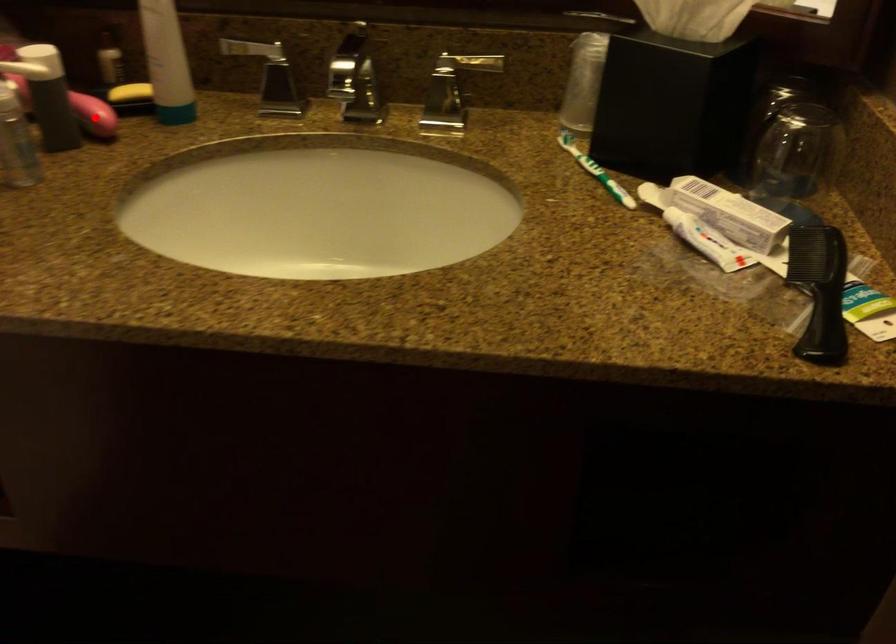
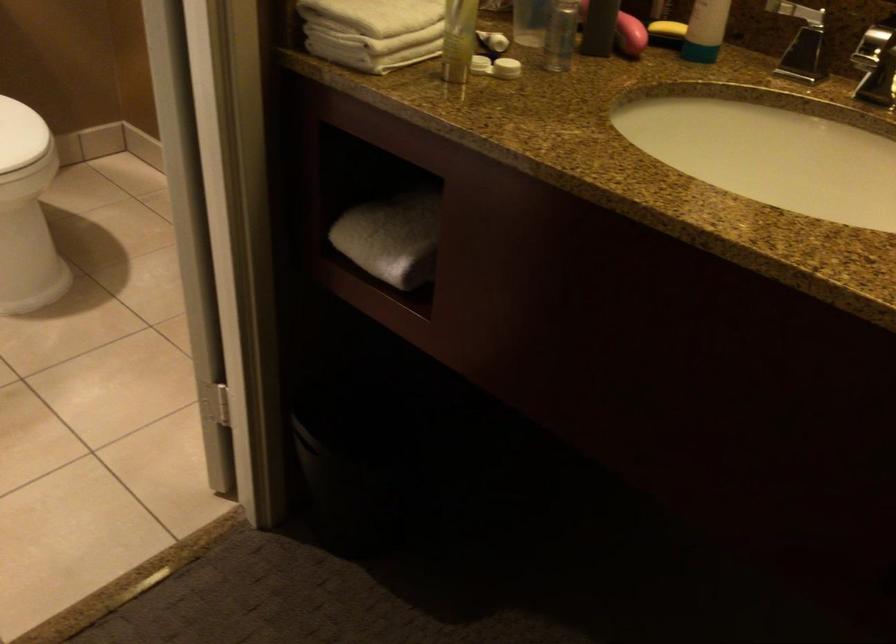
Locate, in the second image, the point that corresponds to the highlighted location in the first image.

(630, 35)